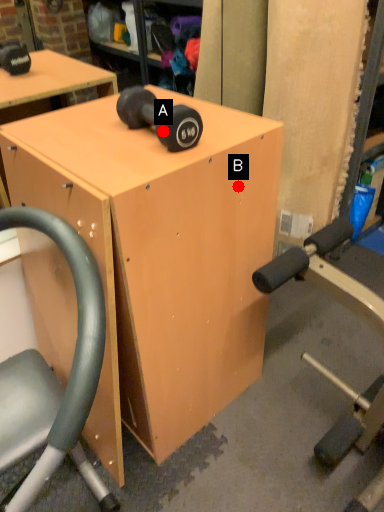
Question: Two points are circled on the image, labeled by A and B beside each circle. Which point is farther to the camera?

Choices:
 (A) A is further
 (B) B is further

Answer: (B)